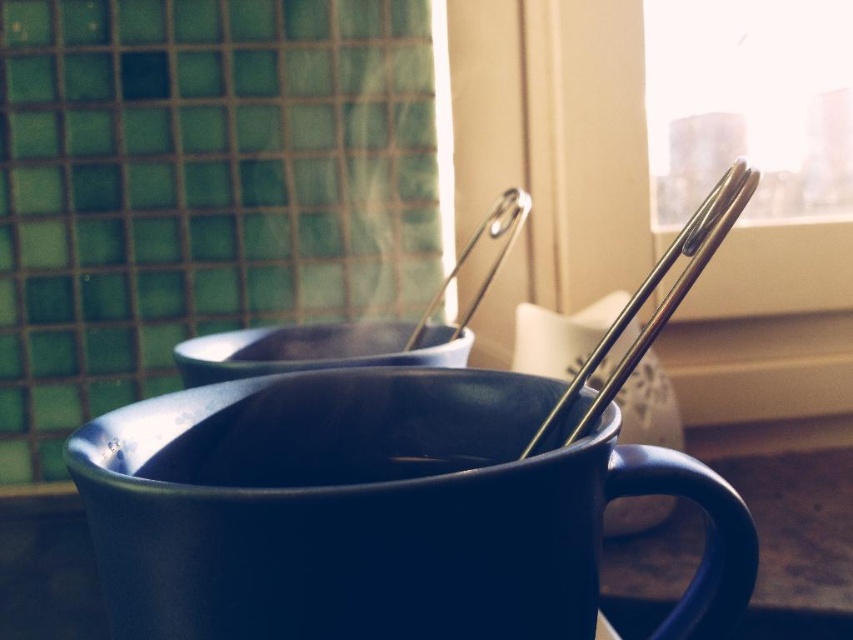
Question: Is glossy ceramic mug at center smaller than polished metal chopsticks at upper right?

Choices:
 (A) no
 (B) yes

Answer: (A)

Question: Which of the following is the closest to the observer?

Choices:
 (A) transparent glass window at upper right
 (B) glossy ceramic mug at center
 (C) matte black mug at center
 (D) silver metallic chopstick at upper center

Answer: (B)

Question: Which point is closer to the camera?

Choices:
 (A) (451, 360)
 (B) (737, 612)
 (C) (738, 68)

Answer: (B)

Question: Among these points, which one is nearest to the camera?

Choices:
 (A) (693, 17)
 (B) (498, 214)
 (C) (189, 449)

Answer: (C)

Question: Is matte black mug at center thinner than silver metallic chopstick at upper center?

Choices:
 (A) yes
 (B) no

Answer: (B)

Question: Is transparent glass window at upper right to the left of polished metal chopsticks at upper right from the viewer's perspective?

Choices:
 (A) yes
 (B) no

Answer: (B)